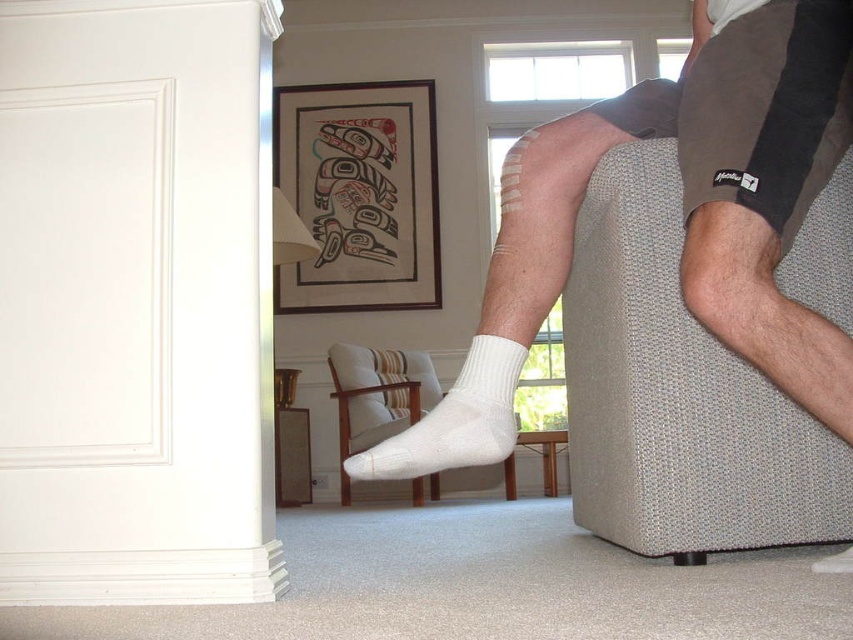
You are a tailor measuring the distance between two white cotton socks in an image. The socks are labeled as white cotton socks at center and white cotton sock at lower center. Given that the minimum required distance for proper fitting is 10 inches, is the current distance sufficient?

The white cotton socks at center and white cotton sock at lower center are 9.78 inches apart from each other, which is less than the required 10 inches. Therefore, the current distance is not sufficient for proper fitting.

You are sitting on the light brown wood armchair at center and want to reach the framed artwork on the wall. Can you see the textured beige armchair at right from your current position?

The textured beige armchair at right is above the light brown wood armchair at center, so yes, you can see the textured beige armchair at right from your current position because it is positioned higher up on the wall.

You are a photographer adjusting your camera to focus on the white cotton socks at center and the white cotton sock at lower center. Which sock should you zoom in on to capture more details, considering their sizes?

The white cotton socks at center is larger in size than the white cotton sock at lower center, so you should zoom in on the white cotton socks at center to capture more details.